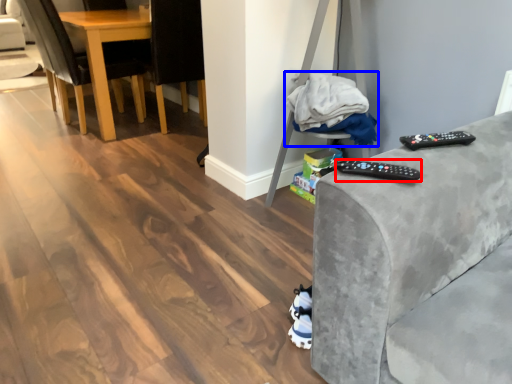
Question: Which object appears closest to the camera in this image, remote (highlighted by a red box) or material (highlighted by a blue box)?

Choices:
 (A) remote
 (B) material

Answer: (A)